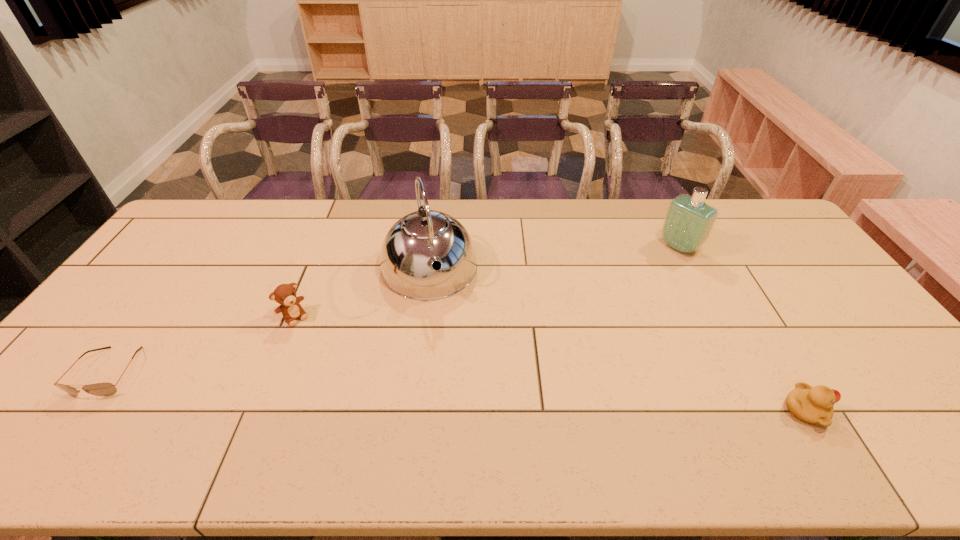
Find the location of a particular element. The height and width of the screenshot is (540, 960). free point between the third shortest object and the perfume is located at coordinates (487, 282).

This screenshot has height=540, width=960. Identify the location of unoccupied area between the leftmost object and the kettle. (269, 321).

You are a GUI agent. You are given a task and a screenshot of the screen. Output one action in this format:
    pyautogui.click(x=<x>, y=<y>)
    Task: Click on the free space between the fourth tallest object and the teddy bear
    Image resolution: width=960 pixels, height=540 pixels.
    Given the screenshot: What is the action you would take?
    pyautogui.click(x=550, y=363)

You are a GUI agent. You are given a task and a screenshot of the screen. Output one action in this format:
    pyautogui.click(x=<x>, y=<y>)
    Task: Click on the free space between the kettle and the shortest object
    
    Given the screenshot: What is the action you would take?
    pyautogui.click(x=269, y=321)

At what (x,y) coordinates should I click in order to perform the action: click on vacant area that lies between the third tallest object and the second tallest object. Please return your answer as a coordinate pair (x, y). This screenshot has width=960, height=540. Looking at the image, I should click on (487, 282).

The height and width of the screenshot is (540, 960). In order to click on blank region between the fourth shortest object and the sunglasses in this screenshot , I will do `click(395, 309)`.

Find the location of a particular element. free point between the perfume and the teddy bear is located at coordinates (487, 282).

Locate an element on the screen. The image size is (960, 540). vacant space in between the teddy bear and the duckling is located at coordinates (550, 363).

You are a GUI agent. You are given a task and a screenshot of the screen. Output one action in this format:
    pyautogui.click(x=<x>, y=<y>)
    Task: Click on the free area in between the perfume and the duckling
    The height and width of the screenshot is (540, 960).
    Given the screenshot: What is the action you would take?
    pyautogui.click(x=742, y=329)

Where is `object that is the fourth closest one to the leftmost object`? object that is the fourth closest one to the leftmost object is located at coordinates (814, 405).